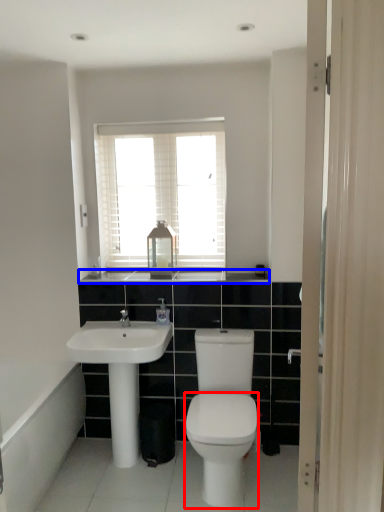
Question: Which object appears closest to the camera in this image, bidet (highlighted by a red box) or counter top (highlighted by a blue box)?

Choices:
 (A) bidet
 (B) counter top

Answer: (A)